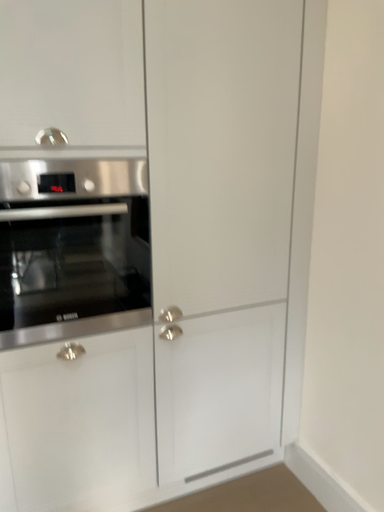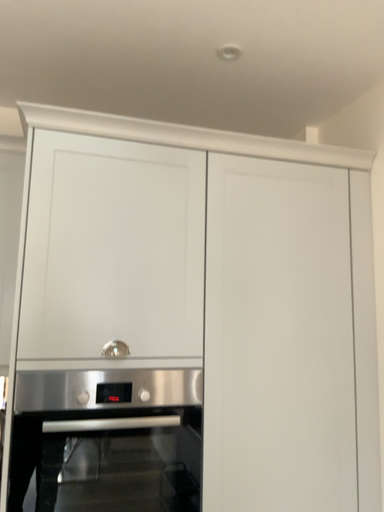
Question: How did the camera likely rotate when shooting the video?

Choices:
 (A) rotated upward
 (B) rotated downward

Answer: (A)